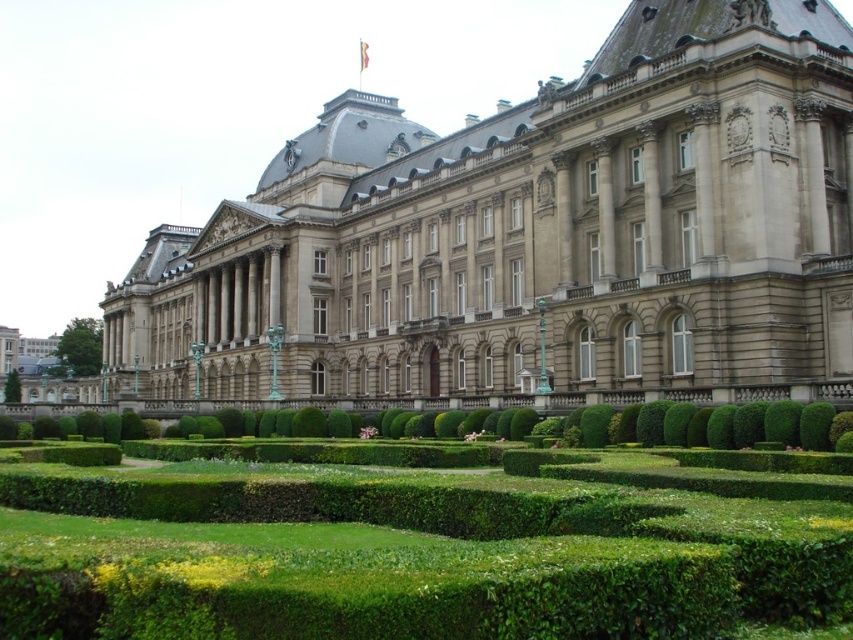
You are standing at the point with coordinates 0.5, 0.5 in the image. Which direction should you move to reach the smooth stone palace at center?

Since the smooth stone palace at center is located at point (532,234) and you are at (426,320), you should move southwest to reach it.

You are standing in the garden and want to take a photo of the smooth stone palace at center. Since the green leafy hedge at center is blocking the view, can you step forward to get a clearer shot?

The smooth stone palace at center is further to the viewer than the green leafy hedge at center, so stepping forward might not help as the palace is already behind the hedge. You might need to move sideways or backward to avoid the hedge blocking the view.

You are a landscape architect designing a pathway that needs to pass between the smooth stone palace at center and the green leafy hedge at center. Since the palace is above the hedge, where should the pathway be placed to avoid both structures?

The pathway should be placed below the smooth stone palace at center and above the green leafy hedge at center to avoid both structures, as the palace is located above the hedge.